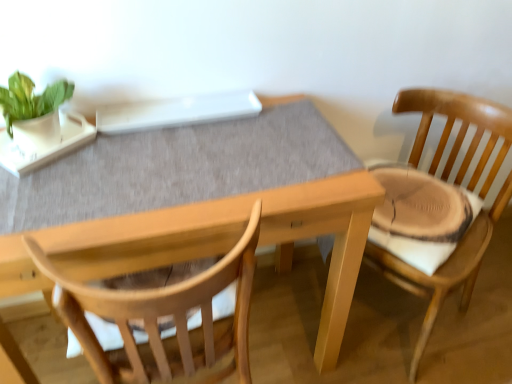
Question: Considering the positions of wooden chair at right and wooden table at center in the image, is wooden chair at right bigger or smaller than wooden table at center?

Choices:
 (A) small
 (B) big

Answer: (A)

Question: From the image's perspective, is wooden chair at right located above or below wooden table at center?

Choices:
 (A) above
 (B) below

Answer: (A)

Question: Which object is positioned farthest from the wooden chair at right?

Choices:
 (A) wooden table at center
 (B) green matte plant at upper left

Answer: (B)

Question: Estimate the real-world distances between objects in this image. Which object is closer to the wooden chair at right?

Choices:
 (A) wooden table at center
 (B) green matte plant at upper left

Answer: (A)